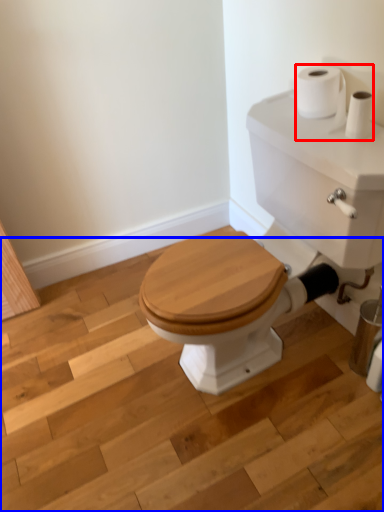
Question: Which of the following is the farthest to the observer, toilet paper (highlighted by a red box) or stair (highlighted by a blue box)?

Choices:
 (A) toilet paper
 (B) stair

Answer: (A)